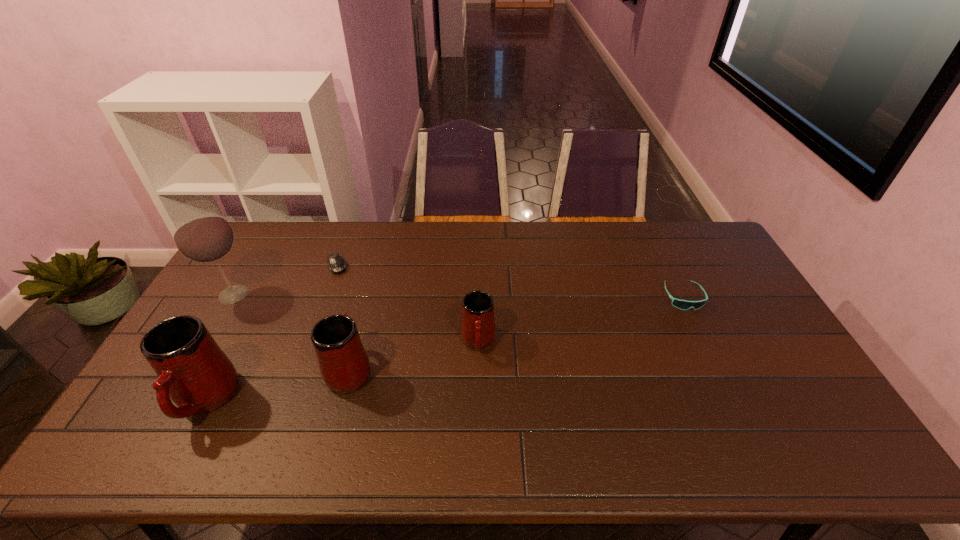
Please point a spot on the right to add another mug. Please provide its 2D coordinates. Your answer should be formatted as a tuple, i.e. [(x, y)], where the tuple contains the x and y coordinates of a point satisfying the conditions above.

[(593, 318)]